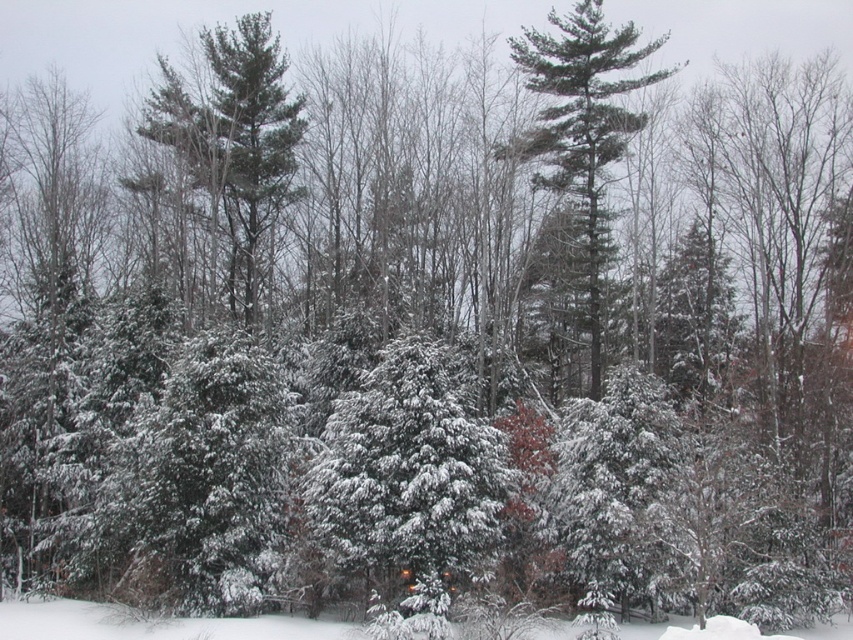
Question: Which object appears closest to the camera in this image?

Choices:
 (A) white fluffy snow at lower center
 (B) green needle-like tree at upper left
 (C) green matte tree at center

Answer: (A)

Question: Does green matte tree at center appear on the right side of white fluffy snow at lower center?

Choices:
 (A) no
 (B) yes

Answer: (B)

Question: Which point appears farthest from the camera in this image?

Choices:
 (A) (169, 634)
 (B) (554, 77)
 (C) (450, 557)

Answer: (B)

Question: Is green matte tree at center below white fluffy snow at lower center?

Choices:
 (A) no
 (B) yes

Answer: (A)

Question: Observing the image, what is the correct spatial positioning of green needle-like tree at upper left in reference to green matte tree at center?

Choices:
 (A) right
 (B) left

Answer: (B)

Question: Which of the following is the closest to the observer?

Choices:
 (A) green matte tree at center
 (B) green needle-like tree at upper left
 (C) snow-covered evergreen at center
 (D) white fluffy snow at lower center

Answer: (D)